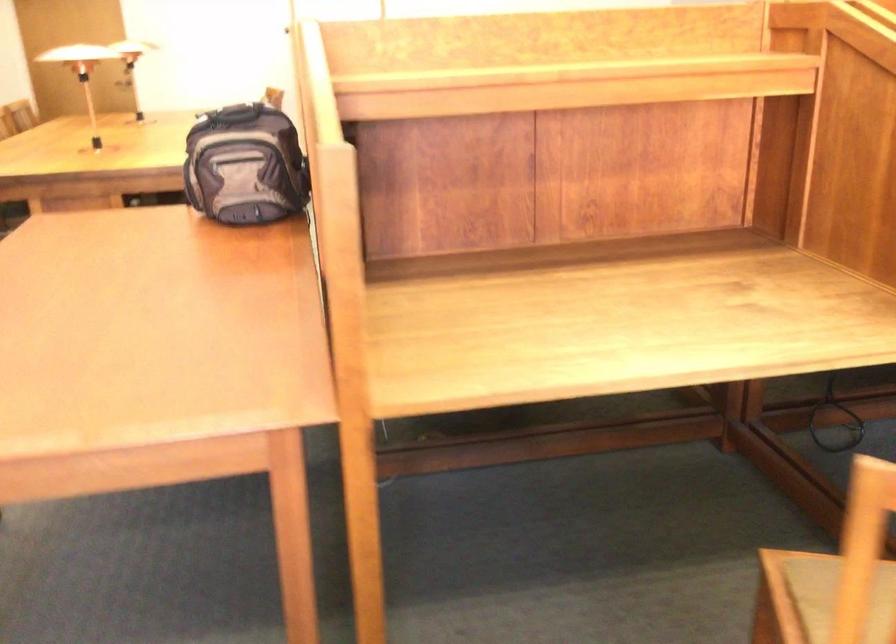
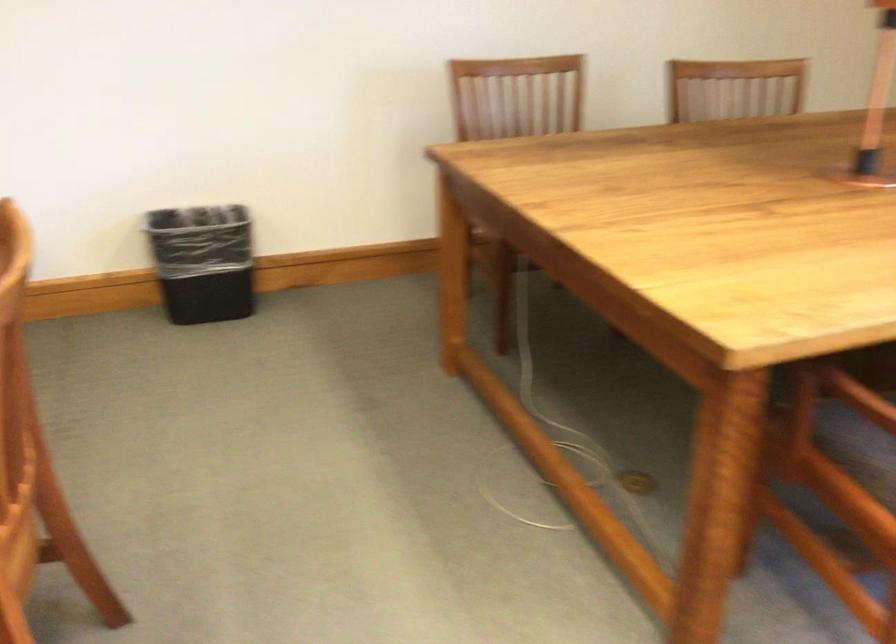
How did the camera likely rotate?

The camera rotated toward right-down.